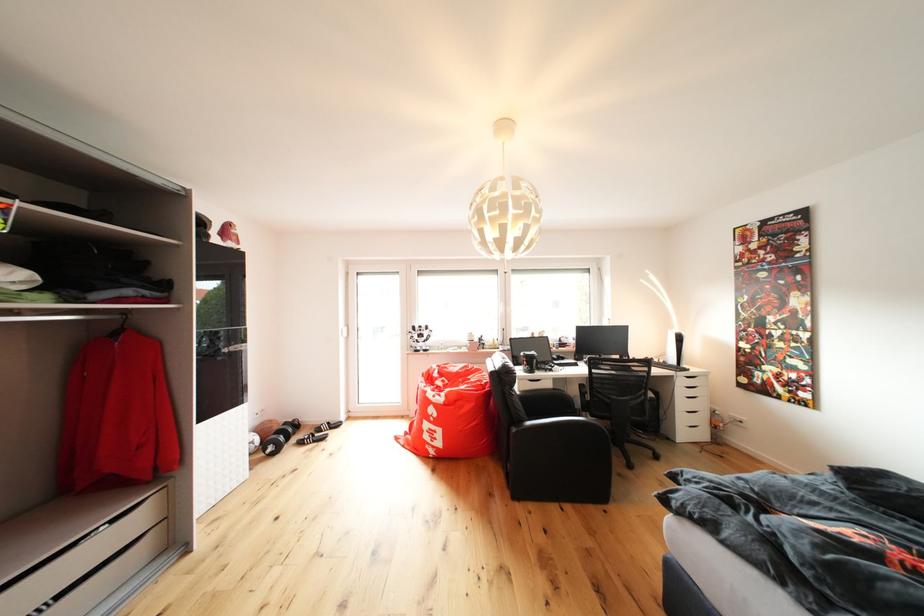
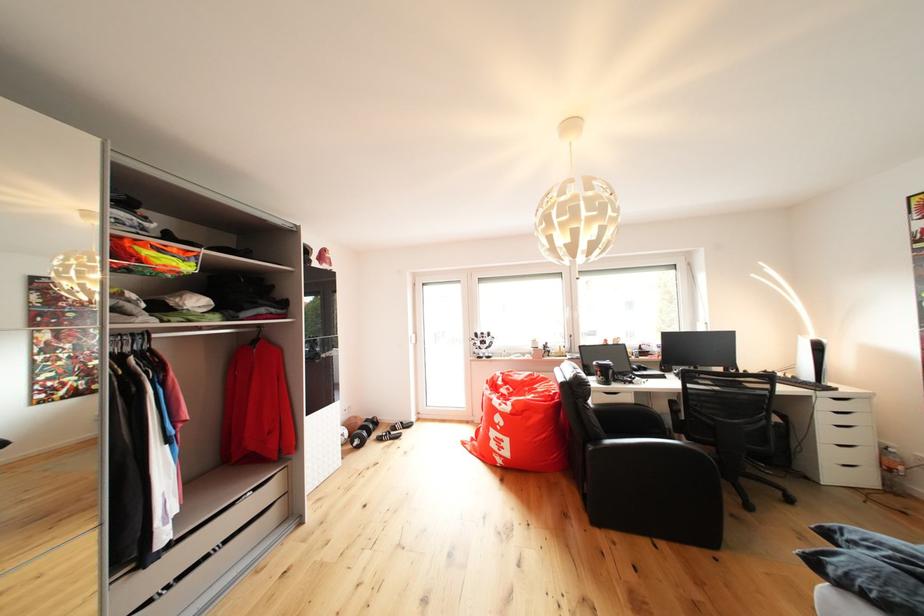
Find the pixel in the second image that matches point (687, 336) in the first image.

(822, 342)